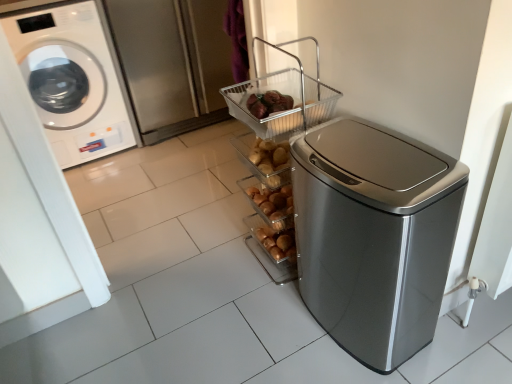
This screenshot has height=384, width=512. Find the location of `vacant space to the left of satin silver trash can at right`. vacant space to the left of satin silver trash can at right is located at coordinates (265, 326).